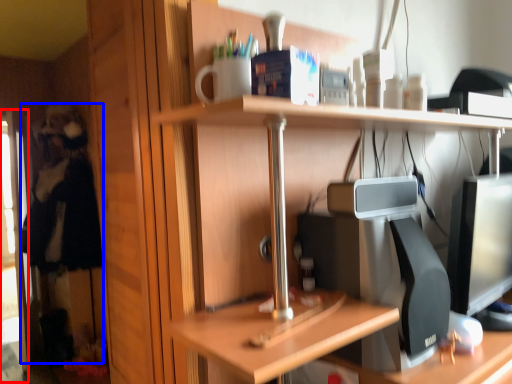
Question: Which object appears closest to the camera in this image, screen door (highlighted by a red box) or person (highlighted by a blue box)?

Choices:
 (A) screen door
 (B) person

Answer: (B)